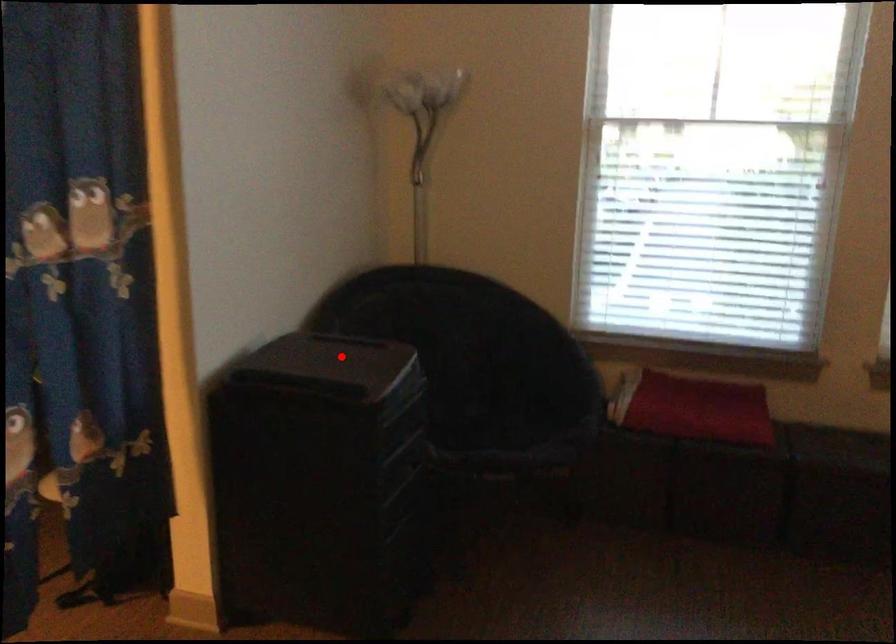
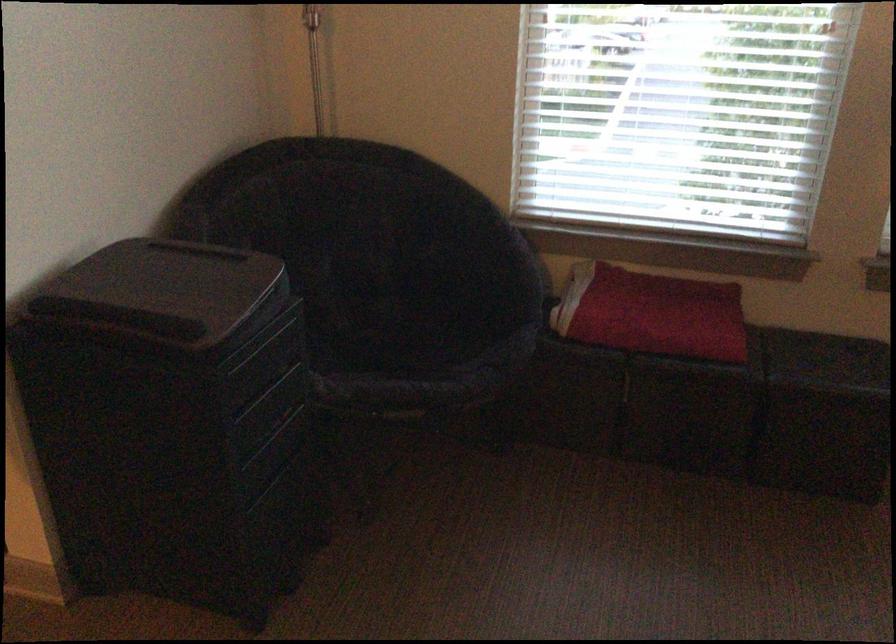
Question: I am providing you with two images of the same scene from different viewpoints. In image1, a red point is highlighted. Considering the same 3D point in image2, which of the following is correct?

Choices:
 (A) It is closer
 (B) It is farther

Answer: (A)